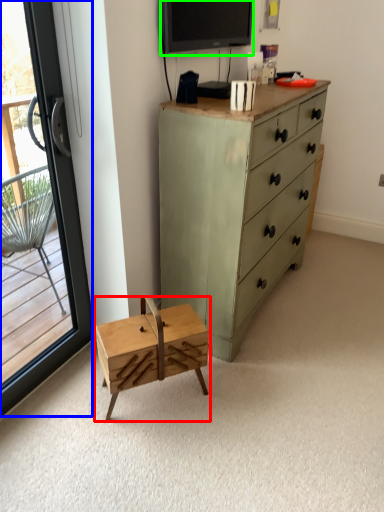
Question: Which is nearer to the changing table (highlighted by a red box)? window (highlighted by a blue box) or television (highlighted by a green box).

Choices:
 (A) window
 (B) television

Answer: (A)